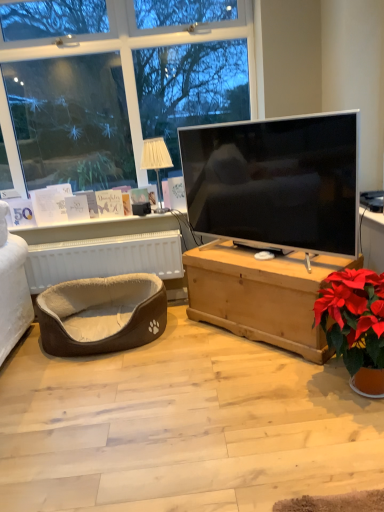
The image size is (384, 512). What are the coordinates of `light brown wooden chest at center` in the screenshot? It's located at (261, 294).

This screenshot has height=512, width=384. Describe the element at coordinates (275, 181) in the screenshot. I see `matte black tv at center` at that location.

You are a GUI agent. You are given a task and a screenshot of the screen. Output one action in this format:
    pyautogui.click(x=<x>, y=<y>)
    Task: Click on the white fabric lampshade at upper center
    The width and height of the screenshot is (384, 512).
    Given the screenshot: What is the action you would take?
    pyautogui.click(x=156, y=163)

You are a GUI agent. You are given a task and a screenshot of the screen. Output one action in this format:
    pyautogui.click(x=<x>, y=<y>)
    Task: Click on the brown plush pet bed at lower left
    The height and width of the screenshot is (512, 384).
    Given the screenshot: What is the action you would take?
    pyautogui.click(x=101, y=314)

Describe the element at coordinates (101, 314) in the screenshot. I see `brown plush pet bed at lower left` at that location.

You are a GUI agent. You are given a task and a screenshot of the screen. Output one action in this format:
    pyautogui.click(x=<x>, y=<y>)
    Task: Click on the white fabric pet bed at lower left
    
    Given the screenshot: What is the action you would take?
    pyautogui.click(x=104, y=258)

The height and width of the screenshot is (512, 384). In order to click on light brown wooden chest at center in this screenshot , I will do `click(261, 294)`.

Based on the photo, between white fabric pet bed at lower left and white fabric lampshade at upper center, which one appears on the right side from the viewer's perspective?

white fabric lampshade at upper center.

From a real-world perspective, is white fabric pet bed at lower left physically above white fabric lampshade at upper center?

Actually, white fabric pet bed at lower left is physically below white fabric lampshade at upper center in the real world.

In terms of width, does white fabric pet bed at lower left look wider or thinner when compared to white fabric lampshade at upper center?

In the image, white fabric pet bed at lower left appears to be more narrow than white fabric lampshade at upper center.

Is brown plush pet bed at lower left oriented away from light brown wooden chest at center?

No, brown plush pet bed at lower left is not facing the opposite direction of light brown wooden chest at center.

Considering the sizes of objects brown plush pet bed at lower left and light brown wooden chest at center in the image provided, who is wider, brown plush pet bed at lower left or light brown wooden chest at center?

brown plush pet bed at lower left is wider.

Considering the positions of objects brown plush pet bed at lower left and light brown wooden chest at center in the image provided, who is behind, brown plush pet bed at lower left or light brown wooden chest at center?

brown plush pet bed at lower left is behind.

From the image's perspective, which object appears higher, brown plush pet bed at lower left or light brown wooden chest at center?

From the image's view, light brown wooden chest at center is above.

Can you confirm if white fabric lampshade at upper center is positioned to the right of matte black tv at center?

In fact, white fabric lampshade at upper center is to the left of matte black tv at center.

Does white fabric lampshade at upper center have a lesser height compared to matte black tv at center?

Indeed, white fabric lampshade at upper center has a lesser height compared to matte black tv at center.

From the image's perspective, would you say white fabric lampshade at upper center is positioned over matte black tv at center?

Yes, from the image's perspective, white fabric lampshade at upper center is on top of matte black tv at center.

Could you tell me if white fabric lampshade at upper center is turned towards matte black tv at center?

No, white fabric lampshade at upper center does not turn towards matte black tv at center.

Looking at their sizes, would you say white fabric pet bed at lower left is wider or thinner than matte black tv at center?

Considering their sizes, white fabric pet bed at lower left looks slimmer than matte black tv at center.

Is matte black tv at center completely or partially inside white fabric pet bed at lower left?

No, matte black tv at center is not inside white fabric pet bed at lower left.

The width and height of the screenshot is (384, 512). I want to click on radiator below the matte black tv at center (from a real-world perspective), so click(104, 258).

Does point (95, 275) appear closer or farther from the camera than point (343, 180)?

Clearly, point (95, 275) is more distant from the camera than point (343, 180).

How different are the orientations of light brown wooden chest at center and white fabric pet bed at lower left in degrees?

There is a 47.6-degree angle between the facing directions of light brown wooden chest at center and white fabric pet bed at lower left.

Between light brown wooden chest at center and white fabric pet bed at lower left, which one appears on the right side from the viewer's perspective?

light brown wooden chest at center is more to the right.

Is white fabric pet bed at lower left at the back of light brown wooden chest at center?

No, light brown wooden chest at center is not facing away from white fabric pet bed at lower left.

How far apart are light brown wooden chest at center and white fabric pet bed at lower left?

light brown wooden chest at center and white fabric pet bed at lower left are 24.76 inches apart.

Identify the location of lamp on the right of brown plush pet bed at lower left. The width and height of the screenshot is (384, 512). (156, 163).

Looking at this image, is brown plush pet bed at lower left next to white fabric lampshade at upper center?

brown plush pet bed at lower left and white fabric lampshade at upper center are clearly separated.

From the image's perspective, which one is positioned higher, brown plush pet bed at lower left or white fabric lampshade at upper center?

white fabric lampshade at upper center.

Looking at this image, can you confirm if light brown wooden chest at center is shorter than matte black tv at center?

Yes, light brown wooden chest at center is shorter than matte black tv at center.

From the image's perspective, does light brown wooden chest at center appear lower than matte black tv at center?

Correct, light brown wooden chest at center appears lower than matte black tv at center in the image.

How much distance is there between light brown wooden chest at center and matte black tv at center?

light brown wooden chest at center is 12.98 inches away from matte black tv at center.

Considering the relative positions of light brown wooden chest at center and matte black tv at center in the image provided, is light brown wooden chest at center to the left or to the right of matte black tv at center?

light brown wooden chest at center is positioned on matte black tv at center's right side.

I want to click on lamp in front of the white fabric pet bed at lower left, so click(156, 163).

Identify the location of bean bag chair lying on the left of light brown wooden chest at center. The height and width of the screenshot is (512, 384). (101, 314).

From the image, which object appears to be farther from white fabric lampshade at upper center, white fabric pet bed at lower left or brown plush pet bed at lower left?

brown plush pet bed at lower left lies further to white fabric lampshade at upper center than the other object.

In the scene shown: Looking at the image, which one is located closer to matte black tv at center, white fabric pet bed at lower left or light brown wooden chest at center?

light brown wooden chest at center.

When comparing their distances from brown plush pet bed at lower left, does white fabric pet bed at lower left or matte black tv at center seem closer?

Based on the image, white fabric pet bed at lower left appears to be nearer to brown plush pet bed at lower left.

Looking at the image, which one is located further to light brown wooden chest at center, matte black tv at center or white fabric lampshade at upper center?

Based on the image, white fabric lampshade at upper center appears to be further to light brown wooden chest at center.

Based on their spatial positions, is brown plush pet bed at lower left or matte black tv at center closer to white fabric lampshade at upper center?

The object closer to white fabric lampshade at upper center is matte black tv at center.

Considering their positions, is white fabric lampshade at upper center positioned further to brown plush pet bed at lower left than white fabric pet bed at lower left?

Among the two, white fabric lampshade at upper center is located further to brown plush pet bed at lower left.

Which object lies nearer to the anchor point brown plush pet bed at lower left, matte black tv at center or white fabric lampshade at upper center?

Among the two, white fabric lampshade at upper center is located nearer to brown plush pet bed at lower left.

When comparing their distances from brown plush pet bed at lower left, does white fabric pet bed at lower left or white fabric lampshade at upper center seem closer?

white fabric pet bed at lower left is positioned closer to the anchor brown plush pet bed at lower left.

Locate an element on the screen. bean bag chair between matte black tv at center and white fabric lampshade at upper center from front to back is located at coordinates (101, 314).

Locate an element on the screen. lamp situated between brown plush pet bed at lower left and light brown wooden chest at center from left to right is located at coordinates (156, 163).

Where is `desk positioned between matte black tv at center and white fabric lampshade at upper center from near to far`? This screenshot has height=512, width=384. desk positioned between matte black tv at center and white fabric lampshade at upper center from near to far is located at coordinates (261, 294).

Image resolution: width=384 pixels, height=512 pixels. I want to click on lamp located between matte black tv at center and white fabric pet bed at lower left in the depth direction, so click(x=156, y=163).